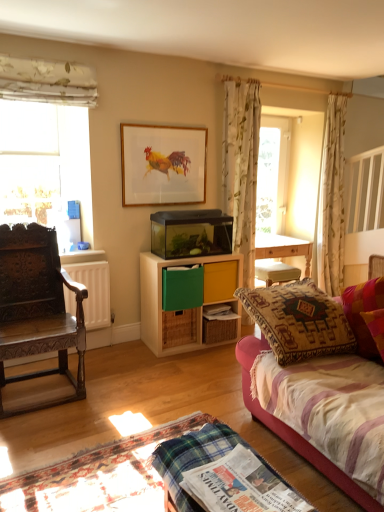
Question: Is green woven drawer at center, which is counted as the 3th drawer, starting from the top, far from floral fabric curtain at center, positioned as the 2th curtain in back-to-front order?

Choices:
 (A) yes
 (B) no

Answer: (A)

Question: Is green woven drawer at center, which is counted as the 3th drawer, starting from the top, outside floral fabric curtain at center, positioned as the 2th curtain in back-to-front order?

Choices:
 (A) yes
 (B) no

Answer: (A)

Question: Is green woven drawer at center, which is counted as the 3th drawer, starting from the top, further to camera compared to floral fabric curtain at center, which is counted as the second curtain, starting from the front?

Choices:
 (A) no
 (B) yes

Answer: (A)

Question: Is green woven drawer at center, which is counted as the 3th drawer, starting from the top, taller than floral fabric curtain at center, which is counted as the second curtain, starting from the front?

Choices:
 (A) no
 (B) yes

Answer: (A)

Question: Considering the relative sizes of green woven drawer at center, which is the 1th drawer in bottom-to-top order, and floral fabric curtain at center, which is counted as the second curtain, starting from the left, in the image provided, is green woven drawer at center, which is the 1th drawer in bottom-to-top order, wider than floral fabric curtain at center, which is counted as the second curtain, starting from the left,?

Choices:
 (A) no
 (B) yes

Answer: (A)

Question: From a real-world perspective, is yellow matte drawer at center, which ranks as the third drawer in bottom-to-top order, physically located above or below white floral fabric at upper left, which is the 3th curtain in right-to-left order?

Choices:
 (A) below
 (B) above

Answer: (A)

Question: Visually, is yellow matte drawer at center, which is the first drawer from top to bottom, positioned to the left or to the right of white floral fabric at upper left, which is the 3th curtain in right-to-left order?

Choices:
 (A) left
 (B) right

Answer: (B)

Question: In terms of width, does yellow matte drawer at center, which is the first drawer from top to bottom, look wider or thinner when compared to white floral fabric at upper left, which is the 3th curtain in right-to-left order?

Choices:
 (A) thin
 (B) wide

Answer: (B)

Question: Does point (210, 280) appear closer or farther from the camera than point (18, 58)?

Choices:
 (A) farther
 (B) closer

Answer: (A)

Question: Considering the positions of carved wood chair at left and yellow matte drawer at center, which ranks as the third drawer in bottom-to-top order, in the image, is carved wood chair at left taller or shorter than yellow matte drawer at center, which ranks as the third drawer in bottom-to-top order,?

Choices:
 (A) tall
 (B) short

Answer: (A)

Question: Considering the relative positions of carved wood chair at left and yellow matte drawer at center, which is the first drawer from top to bottom, in the image provided, is carved wood chair at left to the left or to the right of yellow matte drawer at center, which is the first drawer from top to bottom,?

Choices:
 (A) right
 (B) left

Answer: (B)

Question: Considering the positions of point (13, 279) and point (235, 268), is point (13, 279) closer or farther from the camera than point (235, 268)?

Choices:
 (A) closer
 (B) farther

Answer: (A)

Question: From a real-world perspective, is carved wood chair at left positioned above or below yellow matte drawer at center, which is the first drawer from top to bottom?

Choices:
 (A) above
 (B) below

Answer: (B)

Question: From a real-world perspective, relative to wooden framed picture of rooster at upper center, is velvet pink pillow at right vertically above or below?

Choices:
 (A) above
 (B) below

Answer: (B)

Question: Would you say velvet pink pillow at right is inside or outside wooden framed picture of rooster at upper center?

Choices:
 (A) inside
 (B) outside

Answer: (B)